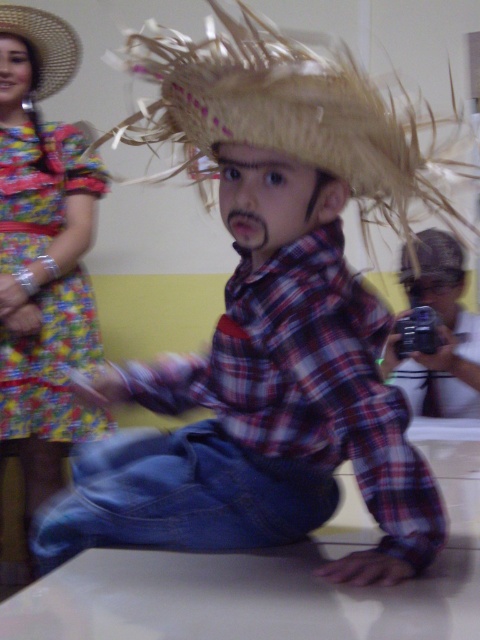
Question: Estimate the real-world distances between objects in this image. Which object is closer to the straw at center?

Choices:
 (A) matte straw hat at center
 (B) natural straw hat at upper left
 (C) floral fabric dress at left

Answer: (A)

Question: Which object is positioned farthest from the natural straw hat at upper left?

Choices:
 (A) floral fabric dress at left
 (B) matte straw hat at center

Answer: (B)

Question: Is floral fabric dress at left positioned in front of natural straw hat at upper left?

Choices:
 (A) no
 (B) yes

Answer: (B)

Question: Can you confirm if matte straw hat at center is wider than natural straw hat at upper left?

Choices:
 (A) no
 (B) yes

Answer: (B)

Question: Is floral fabric dress at left closer to the viewer compared to natural straw hat at upper left?

Choices:
 (A) yes
 (B) no

Answer: (A)

Question: Among these points, which one is farthest from the camera?

Choices:
 (A) (58, 198)
 (B) (437, 369)
 (C) (16, 35)

Answer: (A)